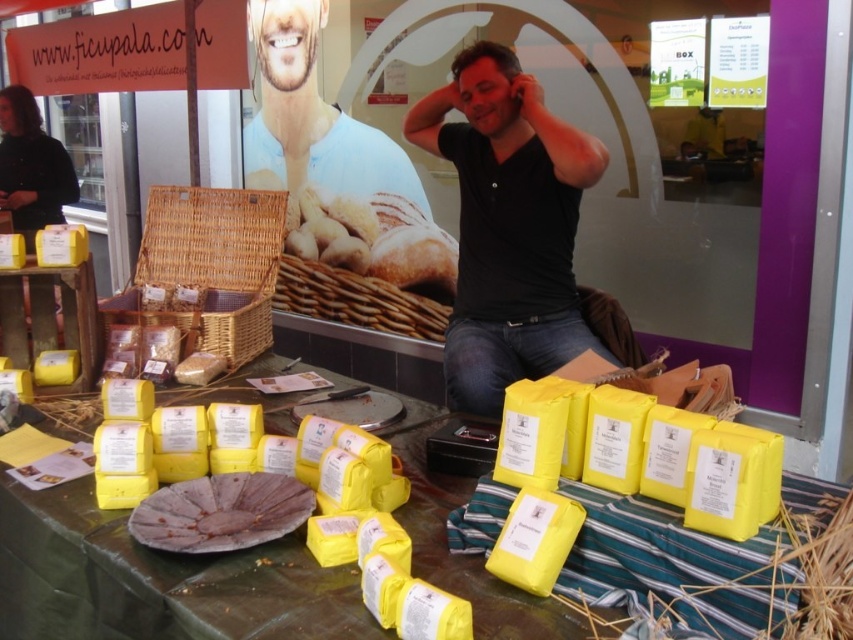
Question: Can you confirm if yellow paper at center is positioned to the right of smooth skin at upper center?

Choices:
 (A) no
 (B) yes

Answer: (B)

Question: Does smooth skin at upper center have a greater width compared to woven brown basket at center?

Choices:
 (A) no
 (B) yes

Answer: (A)

Question: Which point appears closest to the camera in this image?

Choices:
 (A) (549, 202)
 (B) (65, 516)
 (C) (300, 157)
 (D) (315, 232)

Answer: (B)

Question: Estimate the real-world distances between objects in this image. Which object is closer to the smooth skin at upper center?

Choices:
 (A) woven brown basket at center
 (B) black matte shirt at center
 (C) yellow paper at center

Answer: (A)

Question: In this image, where is black matte shirt at center located relative to woven brown basket at center?

Choices:
 (A) left
 (B) right

Answer: (B)

Question: Which object is the closest to the smooth skin at upper center?

Choices:
 (A) yellow paper at center
 (B) woven brown basket at center

Answer: (B)